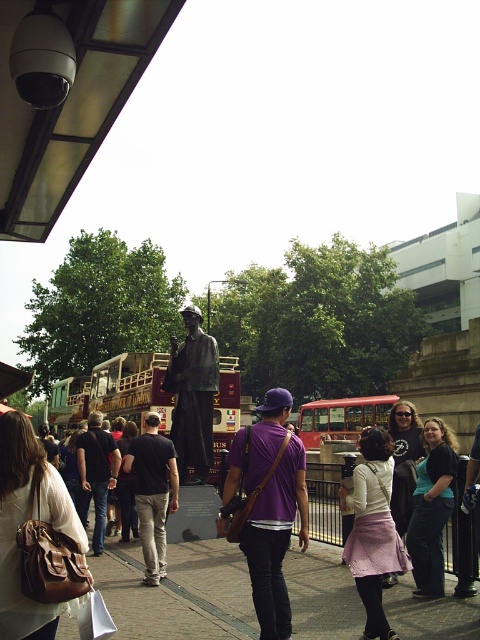
Question: In this image, where is brick red tour bus at center located relative to bronze statue at center?

Choices:
 (A) below
 (B) above

Answer: (A)

Question: Which of these objects is positioned farthest from the dark gray fabric jacket at center?

Choices:
 (A) red metallic bus at center
 (B) bronze statue at center

Answer: (A)

Question: In this image, where is brick red tour bus at center located relative to red metallic bus at center?

Choices:
 (A) above
 (B) below

Answer: (A)

Question: Can you confirm if brick red tour bus at center is positioned to the left of dark gray fabric jacket at center?

Choices:
 (A) no
 (B) yes

Answer: (A)

Question: Which is farther from the dark gray fabric jacket at center?

Choices:
 (A) dark gray fabric pants at center
 (B) red metallic bus at center

Answer: (B)

Question: Considering the real-world distances, which object is closest to the brick red tour bus at center?

Choices:
 (A) red metallic bus at center
 (B) dark gray fabric pants at center

Answer: (A)